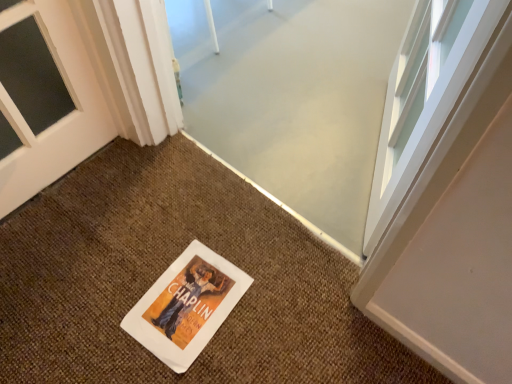
You are a GUI agent. You are given a task and a screenshot of the screen. Output one action in this format:
    pyautogui.click(x=<x>, y=<y>)
    Task: Click on the vacant point above white paper doormat at center (from a real-world perspective)
    
    Given the screenshot: What is the action you would take?
    pyautogui.click(x=143, y=285)